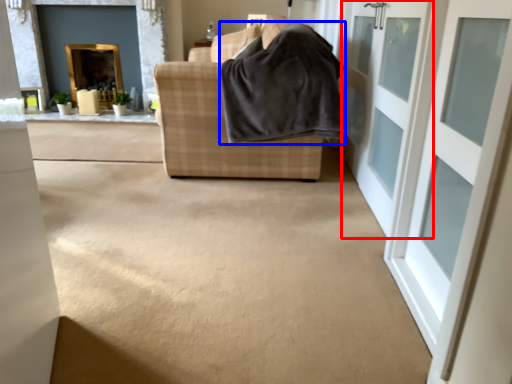
Question: Which point is closer to the camera, door (highlighted by a red box) or blanket (highlighted by a blue box)?

Choices:
 (A) door
 (B) blanket

Answer: (A)